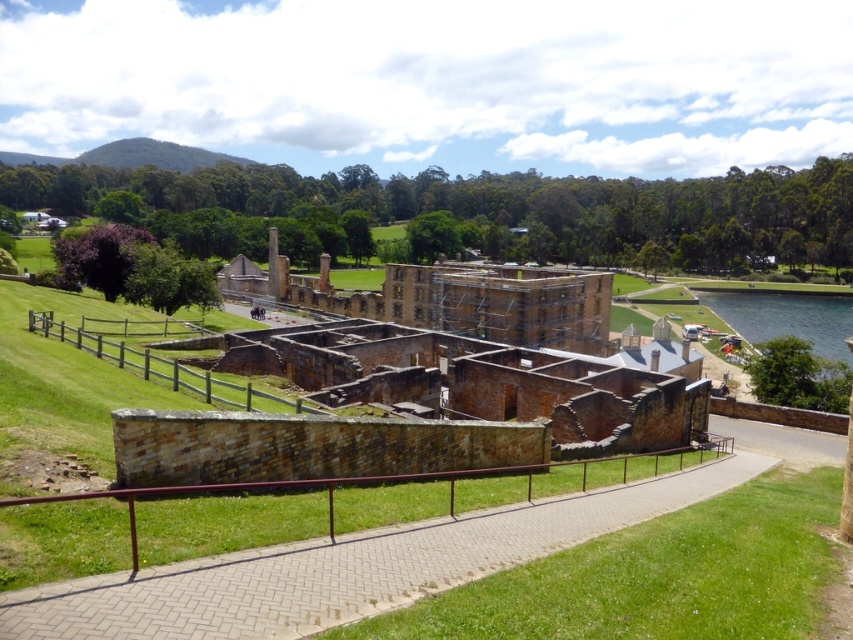
Question: From the image, what is the correct spatial relationship of brick paved walkway at center in relation to brown stone ruins at center?

Choices:
 (A) above
 (B) below

Answer: (B)

Question: From the image, what is the correct spatial relationship of brown stone ruins at center in relation to green grassy lake at lower right?

Choices:
 (A) right
 (B) left

Answer: (B)

Question: Is brown stone ruins at center above green grassy lake at lower right?

Choices:
 (A) no
 (B) yes

Answer: (B)

Question: Which object is the closest to the brown stone ruins at center?

Choices:
 (A) brick paved walkway at center
 (B) green grassy lake at lower right

Answer: (A)

Question: Which of the following is the farthest from the observer?

Choices:
 (A) brick paved walkway at center
 (B) green grassy lake at lower right

Answer: (B)

Question: Which point is closer to the camera?

Choices:
 (A) (802, 308)
 (B) (403, 316)
 (C) (262, 566)

Answer: (C)